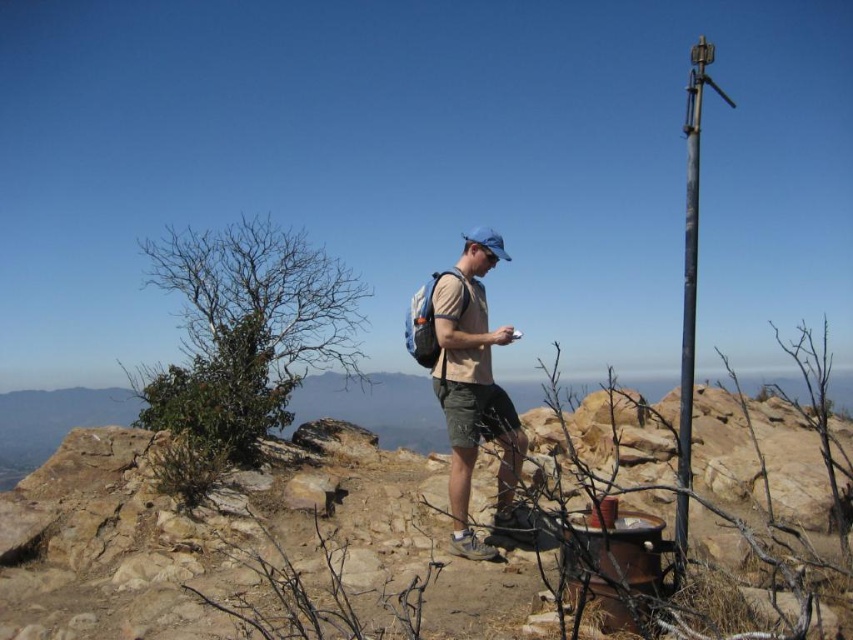
Question: Which object appears farthest from the camera in this image?

Choices:
 (A) tan fabric shirt at center
 (B) dark gray metallic pole at right
 (C) brown rocky hill at center

Answer: (C)

Question: Among these objects, which one is farthest from the camera?

Choices:
 (A) dark gray metallic pole at right
 (B) brown rocky hill at center

Answer: (B)

Question: Which point is farther to the camera?

Choices:
 (A) (798, 388)
 (B) (682, 474)
 (C) (519, 470)

Answer: (A)

Question: In this image, where is brown rocky hill at center located relative to tan fabric shirt at center?

Choices:
 (A) left
 (B) right

Answer: (B)

Question: Is brown rocky hill at center to the right of dark gray metallic pole at right from the viewer's perspective?

Choices:
 (A) yes
 (B) no

Answer: (B)

Question: Considering the relative positions of brown rocky hill at center and tan fabric shirt at center in the image provided, where is brown rocky hill at center located with respect to tan fabric shirt at center?

Choices:
 (A) above
 (B) below

Answer: (B)